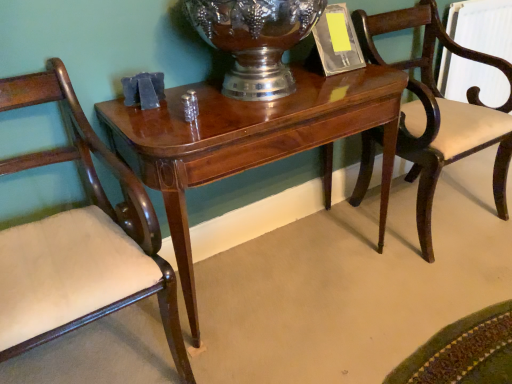
At what (x,y) coordinates should I click in order to perform the action: click on vacant space underneath mahogany wood chair at left, arranged as the 2th chair when viewed from the right (from a real-world perspective). Please return your answer as a coordinate pair (x, y). This screenshot has height=384, width=512. Looking at the image, I should click on (102, 351).